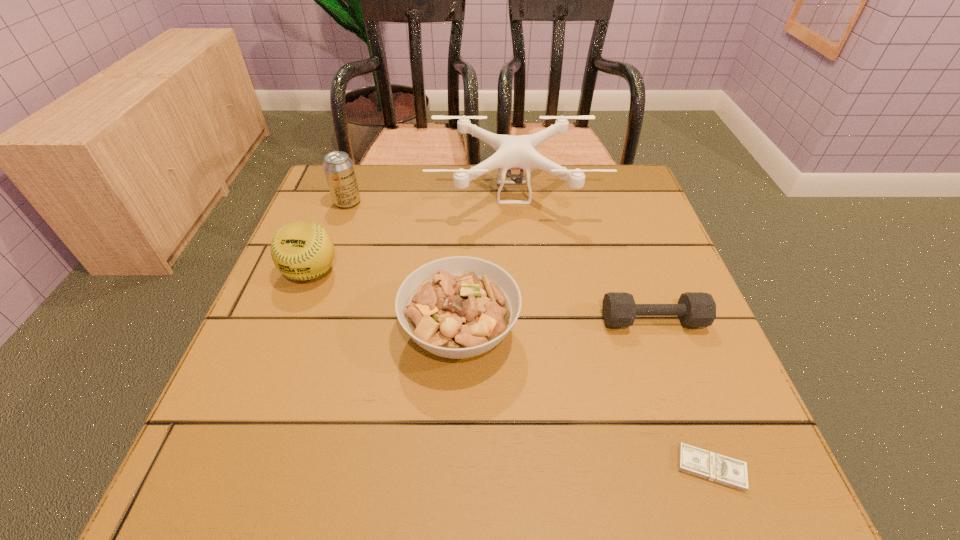
This screenshot has width=960, height=540. I want to click on drone, so click(x=512, y=152).

I want to click on beer can, so click(x=338, y=167).

Image resolution: width=960 pixels, height=540 pixels. In order to click on softball in this screenshot , I will do `click(302, 250)`.

Locate an element on the screen. Image resolution: width=960 pixels, height=540 pixels. stew is located at coordinates (458, 307).

Locate an element on the screen. Image resolution: width=960 pixels, height=540 pixels. dumbbell is located at coordinates (695, 309).

The width and height of the screenshot is (960, 540). Identify the location of the shortest object. (692, 460).

Locate an element on the screen. This screenshot has height=540, width=960. money is located at coordinates (692, 460).

I want to click on vacant space positioned on the top of the drone, so click(x=527, y=340).

Identify the location of vacant space located on the right of the beer can. The image size is (960, 540). (394, 202).

I want to click on vacant space located 0.150m on the logo side of the softball, so click(278, 356).